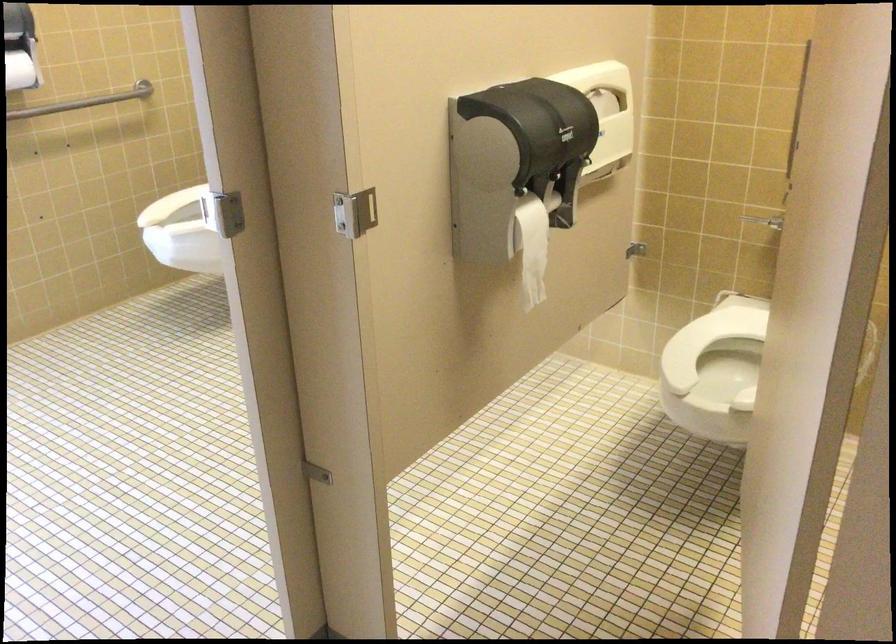
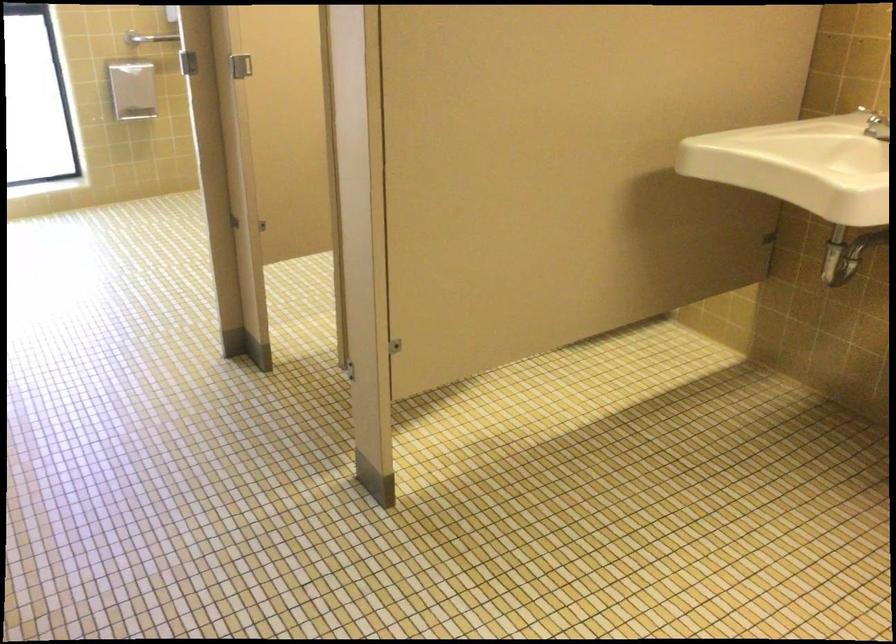
Question: I am providing you with two images of the same scene from different viewpoints. After the viewpoint changes to image2, which objects are now occluded?

Choices:
 (A) metal grab bar
 (B) toilet paper roll
 (C) metal stall latch
 (D) grey woven basket

Answer: (B)